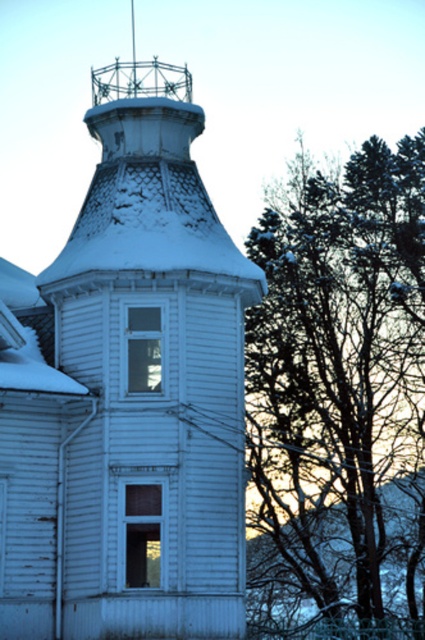
Question: Does white wooden tower at center appear on the left side of snow-covered branches at upper right?

Choices:
 (A) yes
 (B) no

Answer: (A)

Question: Which point is closer to the camera taking this photo?

Choices:
 (A) (167, 342)
 (B) (260, 426)

Answer: (A)

Question: Is white wooden tower at center above snow-covered branches at upper right?

Choices:
 (A) no
 (B) yes

Answer: (B)

Question: Can you confirm if white wooden tower at center is positioned above snow-covered branches at upper right?

Choices:
 (A) yes
 (B) no

Answer: (A)